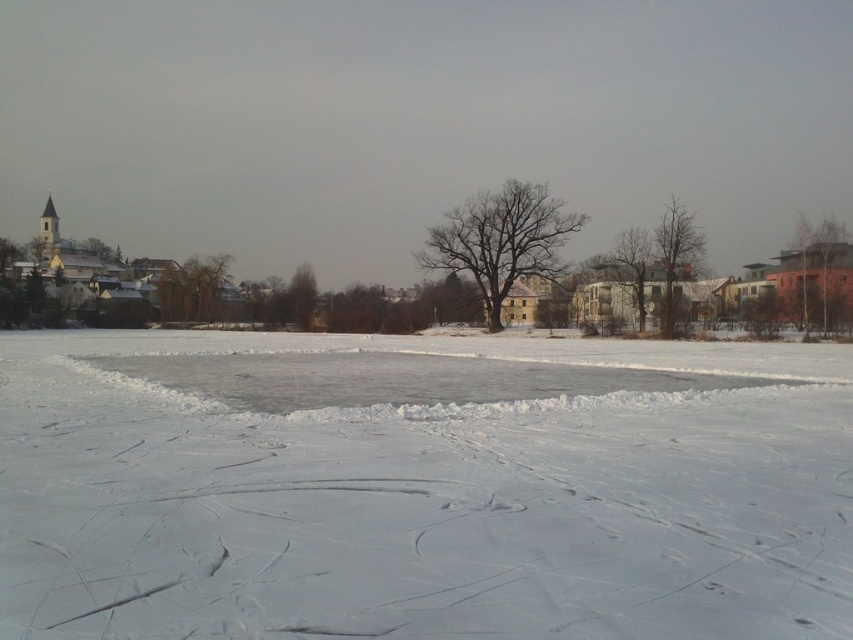
Question: Is bare branches at right bigger than bare branches at center?

Choices:
 (A) yes
 (B) no

Answer: (A)

Question: Which object is farther from the camera taking this photo?

Choices:
 (A) bare brown tree at center
 (B) brown matte tree at right

Answer: (A)

Question: Considering the relative positions of brown matte tree at right and brown matte tree at center in the image provided, where is brown matte tree at right located with respect to brown matte tree at center?

Choices:
 (A) above
 (B) below

Answer: (A)

Question: Is bare brown tree at center thinner than bare branches at right?

Choices:
 (A) no
 (B) yes

Answer: (B)

Question: Among these objects, which one is nearest to the camera?

Choices:
 (A) bare brown tree at center
 (B) bare branches at center
 (C) brown matte tree at center
 (D) brown matte tree at right

Answer: (D)

Question: Which point appears closest to the camera in this image?

Choices:
 (A) (639, 285)
 (B) (457, 240)
 (C) (672, 326)

Answer: (C)